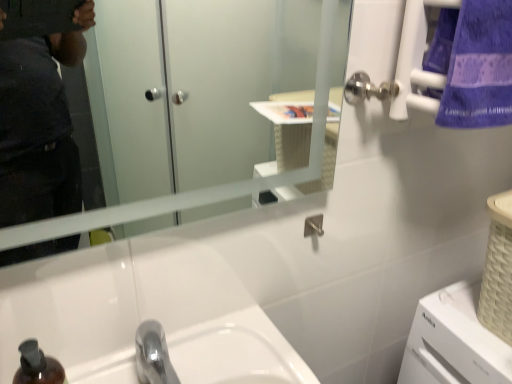
Question: Does point (296, 180) appear closer or farther from the camera than point (507, 8)?

Choices:
 (A) closer
 (B) farther

Answer: (B)

Question: From their relative heights in the image, would you say clear glass mirror at upper center is taller or shorter than purple cotton towel at upper right?

Choices:
 (A) tall
 (B) short

Answer: (A)

Question: Estimate the real-world distances between objects in this image. Which object is farther from the clear glass mirror at upper center?

Choices:
 (A) purple cotton towel at upper right
 (B) chrome metallic sink at center

Answer: (B)

Question: Which object is positioned farthest from the chrome metallic sink at center?

Choices:
 (A) purple cotton towel at upper right
 (B) clear glass mirror at upper center

Answer: (A)